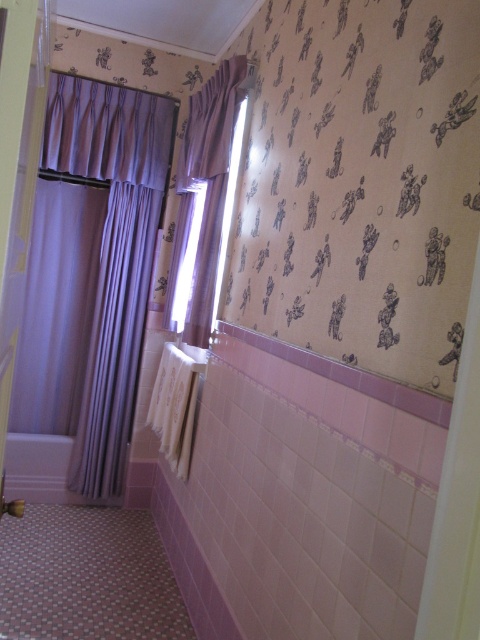
Question: Which of the following is the farthest from the observer?

Choices:
 (A) (166, 301)
 (B) (126, 456)

Answer: (B)

Question: Does purple fabric shower curtain at left come in front of purple fabric curtain at upper center?

Choices:
 (A) yes
 (B) no

Answer: (B)

Question: Among these points, which one is farthest from the camera?

Choices:
 (A) (119, 282)
 (B) (178, 172)

Answer: (A)

Question: Can you confirm if purple fabric shower curtain at left is wider than purple fabric curtain at upper center?

Choices:
 (A) yes
 (B) no

Answer: (A)

Question: Is purple fabric shower curtain at left wider than purple fabric curtain at upper center?

Choices:
 (A) no
 (B) yes

Answer: (B)